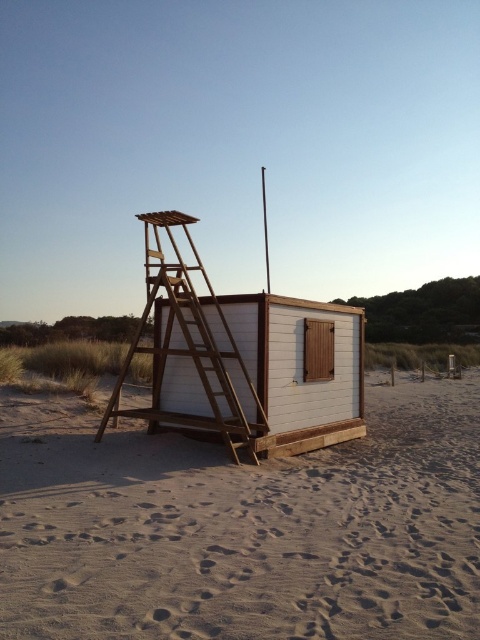
You are a maintenance worker who needs to reach the white wood beach hut at center from the sandy beige at lower center. Can you walk directly to it without any obstacles?

The sandy beige at lower center is 1.90 meters away from the white wood beach hut at center, so yes, you can walk directly to it without any obstacles since the distance is manageable.

You are standing at the origin point of the coordinate system in the image. Which direction should you move to reach the white wood beach hut at center?

The white wood beach hut at center is located at coordinate point 0.575 on the x axis and 0.627 on the y axis, so you should move towards the right and upwards from the origin point to reach it.

You are standing on the sandy beige at lower center looking up at the white wood beach hut at center. Which direction should you face to see the ladder leading to the platform?

You should face upward because the ladder leading to the platform is attached to the back of the white wood beach hut at center, which is located above the sandy beige at lower center.